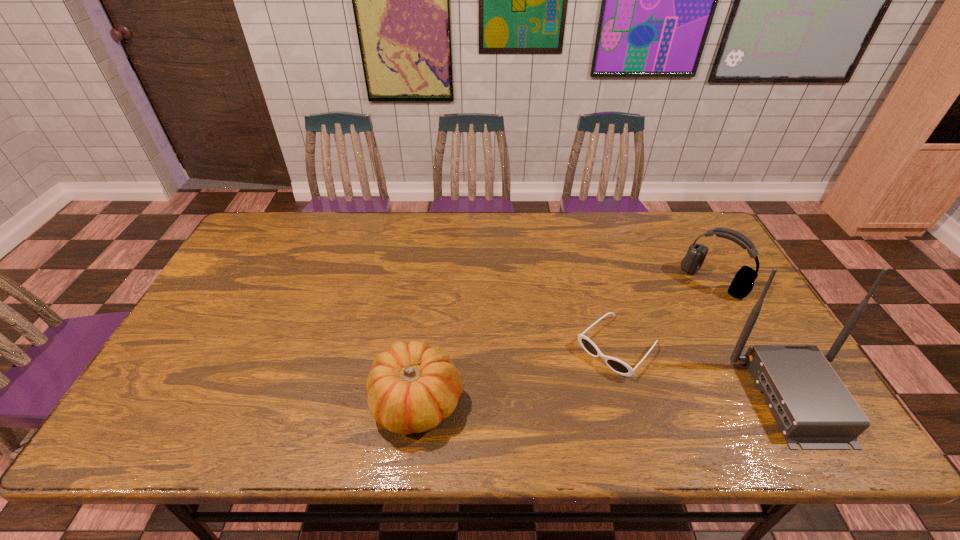
The image size is (960, 540). I want to click on the leftmost object, so click(412, 387).

Where is `the third tallest object`? The image size is (960, 540). the third tallest object is located at coordinates (412, 387).

At what (x,y) coordinates should I click in order to perform the action: click on the tallest object. Please return your answer as a coordinate pair (x, y). The height and width of the screenshot is (540, 960). Looking at the image, I should click on (813, 408).

What are the coordinates of `sunglasses` in the screenshot? It's located at (618, 366).

At what (x,y) coordinates should I click in order to perform the action: click on the third object from right to left. Please return your answer as a coordinate pair (x, y). Looking at the image, I should click on (618, 366).

The image size is (960, 540). What are the coordinates of `the farthest object` in the screenshot? It's located at (742, 284).

Find the location of `the second tallest object`. the second tallest object is located at coordinates (742, 284).

The image size is (960, 540). Find the location of `vacant space positioned on the back of the leftmost object`. vacant space positioned on the back of the leftmost object is located at coordinates (432, 278).

At what (x,y) coordinates should I click in order to perform the action: click on free space located 0.100m with the lenses of the shortest object facing outward. Please return your answer as a coordinate pair (x, y). Looking at the image, I should click on (569, 395).

Where is `free location located on the headband of the farthest object`? This screenshot has width=960, height=540. free location located on the headband of the farthest object is located at coordinates (655, 341).